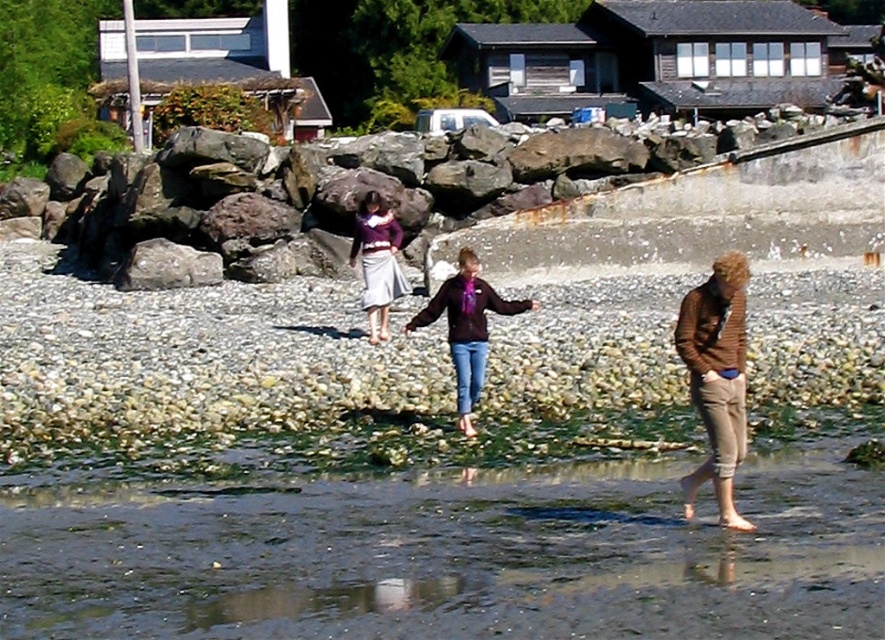
Does rusty concrete wall at upper center have a greater height compared to gray rough rock at left?

Correct, rusty concrete wall at upper center is much taller as gray rough rock at left.

What are the coordinates of `rusty concrete wall at upper center` in the screenshot? It's located at (489, 198).

Image resolution: width=885 pixels, height=640 pixels. Find the location of `rusty concrete wall at upper center`. rusty concrete wall at upper center is located at coordinates (489, 198).

Is rusty concrete wall at upper center taller than matte purple sweater at center?

Yes, rusty concrete wall at upper center is taller than matte purple sweater at center.

Is rusty concrete wall at upper center further to camera compared to matte purple sweater at center?

Yes, it is.

Find the location of a particular element. This screenshot has width=885, height=640. rusty concrete wall at upper center is located at coordinates (489, 198).

Can you confirm if matte purple jacket at center is positioned above matte purple sweater at center?

Actually, matte purple jacket at center is below matte purple sweater at center.

Can you confirm if matte purple jacket at center is positioned to the right of matte purple sweater at center?

Correct, you'll find matte purple jacket at center to the right of matte purple sweater at center.

You are a GUI agent. You are given a task and a screenshot of the screen. Output one action in this format:
    pyautogui.click(x=<x>, y=<y>)
    Task: Click on the matte purple jacket at center
    The image size is (885, 640).
    Given the screenshot: What is the action you would take?
    pyautogui.click(x=466, y=326)